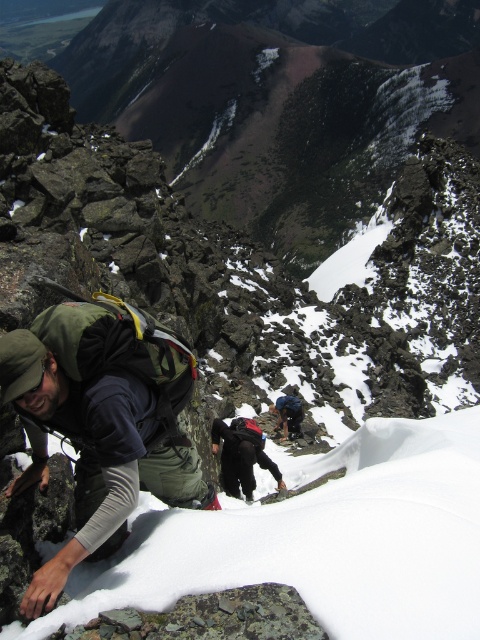
You are a drone operator trying to capture a photo of the two climbers on the mountain. You have two points marked on your screen corresponding to their positions. The first point is at coordinates point (x=113, y=422) and the second point is at point (x=254, y=435). Based on the scene description, which point is closer to the camera?

Point (x=113, y=422) is closer to the camera than point (x=254, y=435).

You are a hiker planning to carry both the green fabric backpack at left and the dark blue ski suit at center. Given their sizes, which one would you place first in your storage compartment to maximize space efficiency?

The green fabric backpack at left is larger in width than the dark blue ski suit at center, so you should place the green fabric backpack at left first to maximize space efficiency.